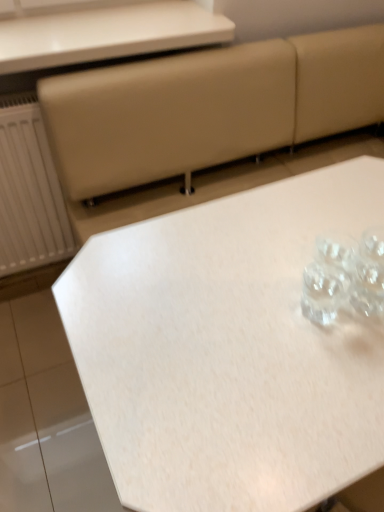
Image resolution: width=384 pixels, height=512 pixels. I want to click on vacant region above white glossy table at upper center, marked as the first table in a top-to-bottom arrangement (from a real-world perspective), so click(107, 27).